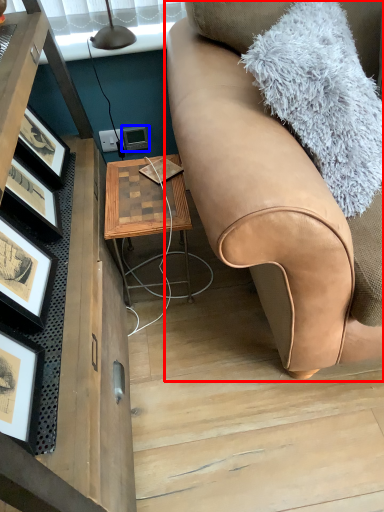
Question: Which object is closer to the camera taking this photo, studio couch (highlighted by a red box) or picture frame (highlighted by a blue box)?

Choices:
 (A) studio couch
 (B) picture frame

Answer: (A)